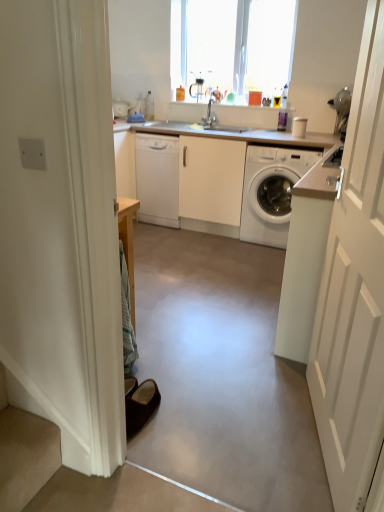
Question: From a real-world perspective, relative to satin nickel faucet at center, is white glossy washing machine at right vertically above or below?

Choices:
 (A) above
 (B) below

Answer: (B)

Question: Is point (291, 151) positioned closer to the camera than point (213, 115)?

Choices:
 (A) farther
 (B) closer

Answer: (B)

Question: Which of these objects is positioned farthest from the white glossy washing machine at right?

Choices:
 (A) brown suede slippers at lower left
 (B) white glossy countertop at center
 (C) smooth concrete floor at center
 (D) transparent glass window at upper center
 (E) white glossy dishwasher at center

Answer: (A)

Question: Which is farther from the white wooden door at right?

Choices:
 (A) white glossy dishwasher at center
 (B) white glossy washing machine at right
 (C) satin nickel faucet at center
 (D) smooth concrete floor at center
 (E) white glossy countertop at center

Answer: (C)